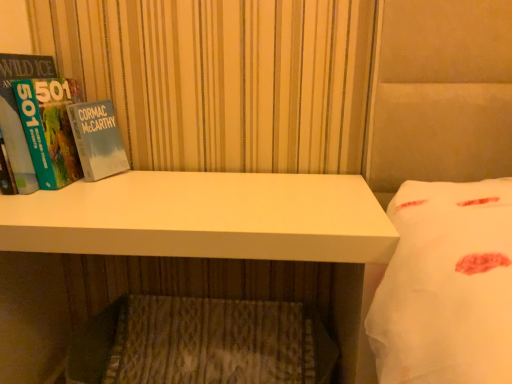
The image size is (512, 384). What are the coordinates of `hardcover book at left` in the screenshot? It's located at (68, 134).

Does point (104, 225) come closer to viewer compared to point (109, 130)?

Yes, it is.

Would you say hardcover book at left is part of white matte desk at center's contents?

No, hardcover book at left is located outside of white matte desk at center.

At what (x,y) coordinates should I click in order to perform the action: click on book located above the white matte desk at center (from a real-world perspective). Please return your answer as a coordinate pair (x, y). The image size is (512, 384). Looking at the image, I should click on (68, 134).

Is white matte desk at center positioned with its back to hardcover book at left?

No, white matte desk at center is not facing away from hardcover book at left.

Does white matte desk at center turn towards wooden textured mattress at lower center?

Yes, white matte desk at center faces towards wooden textured mattress at lower center.

Would you say white matte desk at center is outside wooden textured mattress at lower center?

No, white matte desk at center is inside wooden textured mattress at lower center's boundary.

You are a GUI agent. You are given a task and a screenshot of the screen. Output one action in this format:
    pyautogui.click(x=<x>, y=<y>)
    Task: Click on the desk lying above the wooden textured mattress at lower center (from the image's perspective)
    The width and height of the screenshot is (512, 384).
    Given the screenshot: What is the action you would take?
    pyautogui.click(x=188, y=246)

Who is shorter, white matte desk at center or wooden textured mattress at lower center?

wooden textured mattress at lower center.

How many degrees apart are the facing directions of wooden textured mattress at lower center and hardcover book at left?

They differ by 0.000667 degrees in their facing directions.

Does wooden textured mattress at lower center have a lesser width compared to hardcover book at left?

No.

Is wooden textured mattress at lower center at the left side of hardcover book at left?

Incorrect, wooden textured mattress at lower center is not on the left side of hardcover book at left.

Is hardcover book at left far from wooden textured mattress at lower center?

No, hardcover book at left is not far from wooden textured mattress at lower center.

Between point (119, 150) and point (123, 363), which one is positioned in front?

The point (119, 150) is more forward.

The width and height of the screenshot is (512, 384). Identify the location of book in front of the wooden textured mattress at lower center. (68, 134).

Which is behind, hardcover book at left or wooden textured mattress at lower center?

wooden textured mattress at lower center is behind.

Can you see hardcover book at left touching white matte desk at center?

They are not placed beside each other.

From the image's perspective, is hardcover book at left over white matte desk at center?

Yes, from the image's perspective, hardcover book at left is above white matte desk at center.

Find the location of a particular element. book behind the white matte desk at center is located at coordinates tap(68, 134).

Considering the sizes of objects wooden textured mattress at lower center and white matte desk at center in the image provided, who is wider, wooden textured mattress at lower center or white matte desk at center?

With larger width is white matte desk at center.

Would you say wooden textured mattress at lower center is outside white matte desk at center?

No, wooden textured mattress at lower center is not entirely external to white matte desk at center.

Which is closer to the camera, (219, 362) or (372, 362)?

Point (219, 362).

Locate an element on the screen. This screenshot has height=384, width=512. mattress beneath the white matte desk at center (from a real-world perspective) is located at coordinates (211, 342).

Identify the location of desk in front of the hardcover book at left. [188, 246].

There is a wooden textured mattress at lower center. Where is `desk above it (from a real-world perspective)`? desk above it (from a real-world perspective) is located at coordinates (x=188, y=246).

Consider the image. Based on their spatial positions, is hardcover book at left or wooden textured mattress at lower center further from white matte desk at center?

Among the two, wooden textured mattress at lower center is located further to white matte desk at center.

Estimate the real-world distances between objects in this image. Which object is further from wooden textured mattress at lower center, hardcover book at left or white matte desk at center?

hardcover book at left.

Considering their positions, is wooden textured mattress at lower center positioned further to white matte desk at center than hardcover book at left?

wooden textured mattress at lower center is further to white matte desk at center.

From the image, which object appears to be nearer to wooden textured mattress at lower center, white matte desk at center or hardcover book at left?

The object closer to wooden textured mattress at lower center is white matte desk at center.

Considering their positions, is white matte desk at center positioned closer to hardcover book at left than wooden textured mattress at lower center?

white matte desk at center is positioned closer to the anchor hardcover book at left.

Estimate the real-world distances between objects in this image. Which object is further from hardcover book at left, wooden textured mattress at lower center or white matte desk at center?

The object further to hardcover book at left is wooden textured mattress at lower center.

Identify the location of desk that lies between hardcover book at left and wooden textured mattress at lower center from top to bottom. (188, 246).